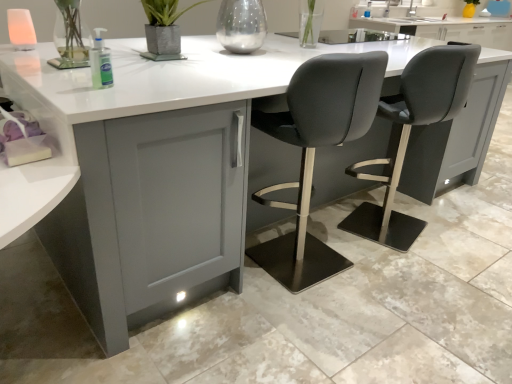
Measure the distance between point (152, 16) and camera.

A distance of 5.91 feet exists between point (152, 16) and camera.

At what (x,y) coordinates should I click in order to perform the action: click on matte gray concrete planter at center. Please return your answer as a coordinate pair (x, y). The height and width of the screenshot is (384, 512). Looking at the image, I should click on (163, 29).

Describe the element at coordinates (163, 29) in the screenshot. Image resolution: width=512 pixels, height=384 pixels. I see `matte gray concrete planter at center` at that location.

You are a GUI agent. You are given a task and a screenshot of the screen. Output one action in this format:
    pyautogui.click(x=<x>, y=<y>)
    Task: Click on the matte gray concrete planter at center
    This screenshot has height=384, width=512.
    Given the screenshot: What is the action you would take?
    pyautogui.click(x=163, y=29)